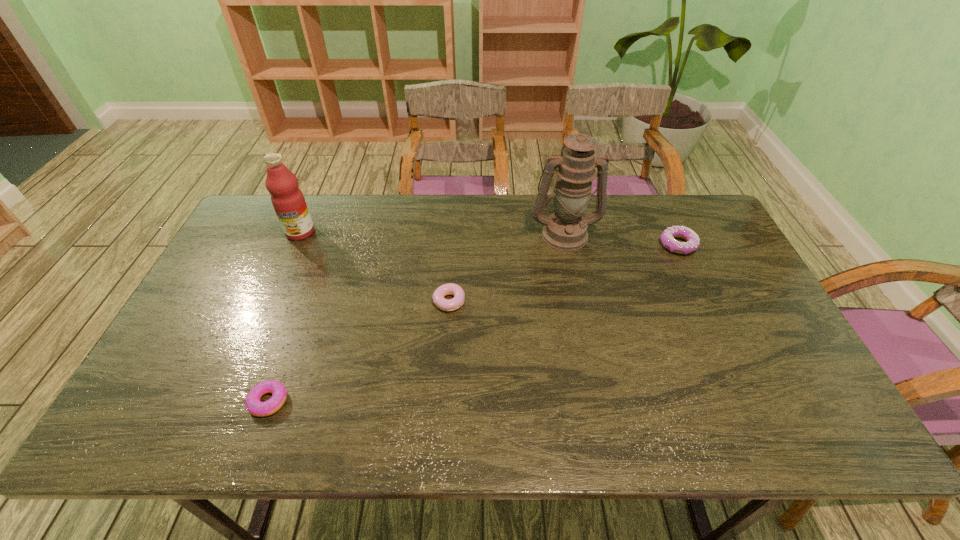
Identify the location of blank region between the second object from right to left and the second object from left to right. click(417, 318).

You are a GUI agent. You are given a task and a screenshot of the screen. Output one action in this format:
    pyautogui.click(x=<x>, y=<y>)
    Task: Click on the vacant region between the second doughnut from left to right and the tallest object
    The image size is (960, 540).
    Given the screenshot: What is the action you would take?
    pyautogui.click(x=507, y=268)

Where is `vacant point located between the second object from right to left and the fourth tallest object`? This screenshot has width=960, height=540. vacant point located between the second object from right to left and the fourth tallest object is located at coordinates (507, 268).

You are a GUI agent. You are given a task and a screenshot of the screen. Output one action in this format:
    pyautogui.click(x=<x>, y=<y>)
    Task: Click on the unoccupied area between the shortest object and the second nearest object
    This screenshot has width=960, height=540.
    Given the screenshot: What is the action you would take?
    [359, 352]

Where is `free point between the third shortest object and the shortest object`? This screenshot has width=960, height=540. free point between the third shortest object and the shortest object is located at coordinates (473, 323).

The width and height of the screenshot is (960, 540). What are the coordinates of `vacant area between the oil lamp and the rightmost object` in the screenshot? It's located at (621, 239).

This screenshot has height=540, width=960. I want to click on free spot between the second object from left to right and the leftmost object, so click(x=284, y=317).

This screenshot has width=960, height=540. I want to click on the fourth closest object relative to the nearest doughnut, so click(x=692, y=243).

At what (x,y) coordinates should I click in order to perform the action: click on object that is the second closest one to the fourth object from right to left. Please return your answer as a coordinate pair (x, y). Looking at the image, I should click on (288, 201).

Select which doughnut appears as the closest to the oil lamp. Please provide its 2D coordinates. Your answer should be formatted as a tuple, i.e. [(x, y)], where the tuple contains the x and y coordinates of a point satisfying the conditions above.

[(692, 243)]